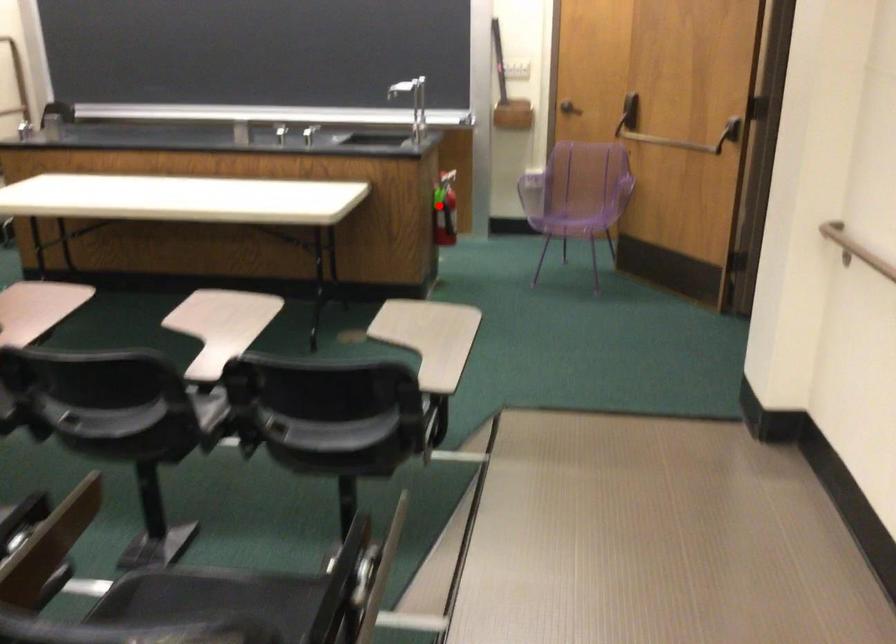
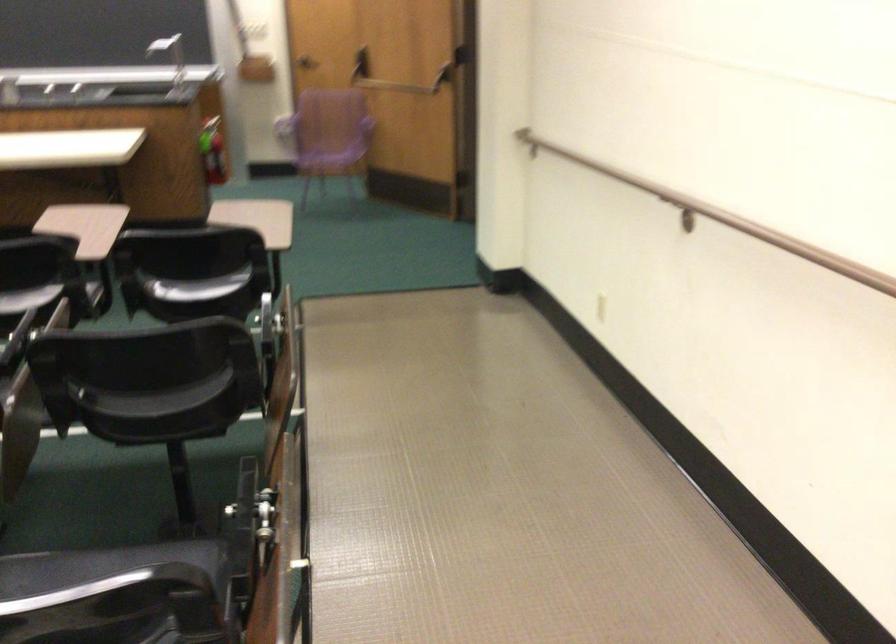
Question: I am providing you with two images of the same scene from different viewpoints. A red point is shown in image1. For the corresponding object point in image2, is it positioned nearer or farther from the camera?

Choices:
 (A) Nearer
 (B) Farther

Answer: (B)